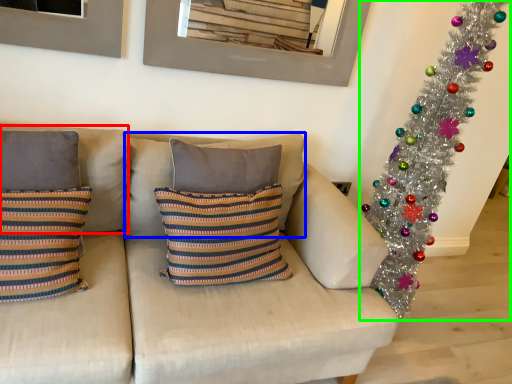
Question: Considering the real-world distances, which object is closest to pillow (highlighted by a red box)? pillow (highlighted by a blue box) or christmas tree (highlighted by a green box).

Choices:
 (A) pillow
 (B) christmas tree

Answer: (A)